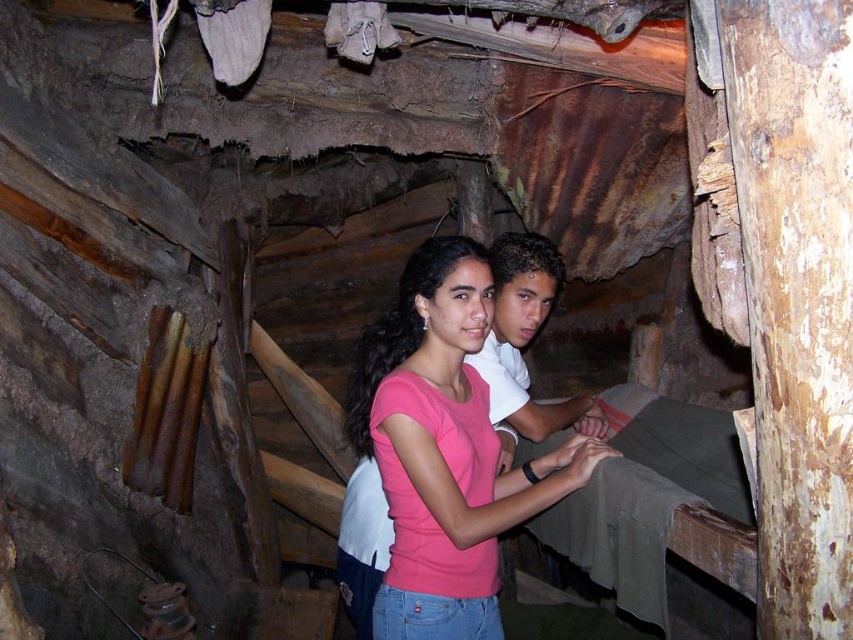
You are standing in the rustic structure and want to reach a point marked at coordinates (548, 460). If you have a 1.5 meter long stick, can you reach that point without moving your position?

The distance of point (548, 460) from viewer is 1.85 meters, so the 1.5 meter long stick is not long enough to reach the point from your current position.

You are a photographer trying to capture both the pink matte shirt at center and the white matte shirt at center in a single frame. Based on their positions, which shirt should you focus on first to ensure both are in focus?

The pink matte shirt at center is positioned under the white matte shirt at center, so focusing on the white matte shirt at center first would ensure both are in focus since it is closer to the camera.

You are a photographer trying to capture a group photo of two people wearing pink matte shirt at center and white matte shirt at center. Since you want to ensure both subjects are framed properly, which person should you position closer to the camera to maintain their relative sizes in the photo?

The white matte shirt at center should be positioned closer to the camera because it has a smaller height than the pink matte shirt at center. By placing the shorter subject closer, their sizes in the photo will appear more balanced.